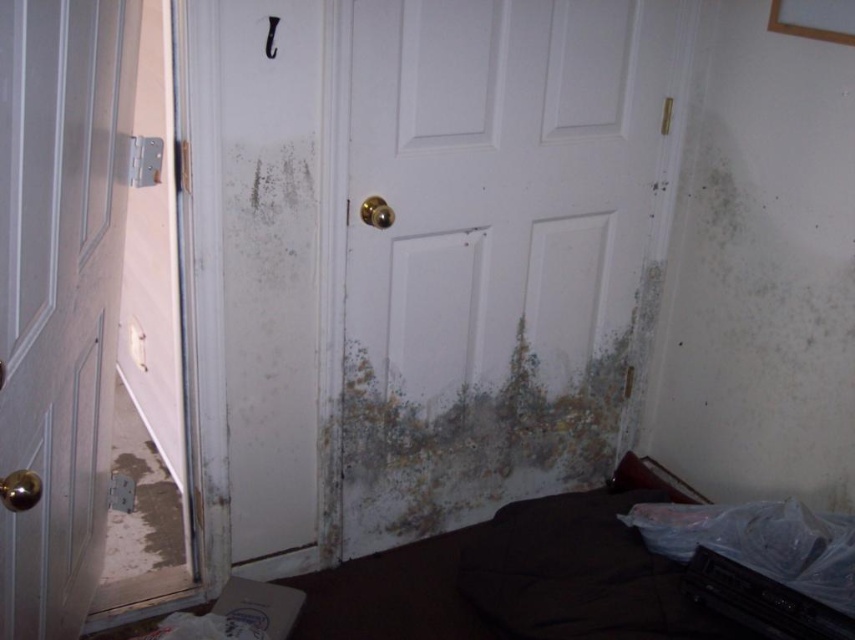
You are standing in the room and see two points marked in the image. Which point is closer to you, point (429, 90) or point (57, 275)?

Point (57, 275) is closer to you because it is less further to the viewer than point (429, 90).